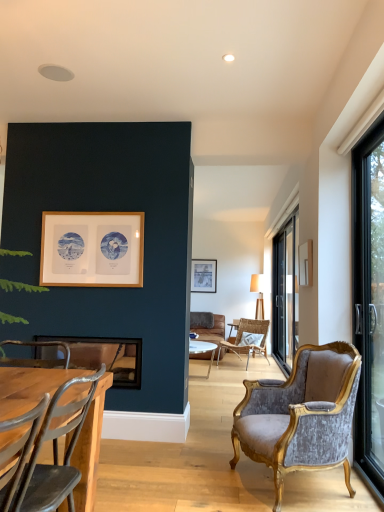
Question: From their relative heights in the image, would you say black glass door at right, placed as the first window when sorted from back to front, is taller or shorter than wooden frame at upper left, the third picture frame positioned from the bottom?

Choices:
 (A) tall
 (B) short

Answer: (A)

Question: Based on their positions, is black glass door at right, marked as the second window in a front-to-back arrangement, located to the left or right of wooden frame at upper left, which ranks as the second picture frame in front-to-back order?

Choices:
 (A) right
 (B) left

Answer: (A)

Question: Which of these objects is positioned farthest from the woven rattan chair at center, the first chair positioned from the back?

Choices:
 (A) matte wooden picture frame at center, the 3th picture frame positioned from the front
 (B) velvet/gold armchair at right, which is the 2th chair in back-to-front order
 (C) black glass door at right, which appears as the first window when viewed from the left
 (D) wooden frame at upper left, the 2th picture frame when ordered from back to front
 (E) black glass door at right, the 1th window in the right-to-left sequence

Answer: (C)

Question: Which object is the closest to the black glass door at right, marked as the second window in a front-to-back arrangement?

Choices:
 (A) metallic gray chair at lower left, the 1th chair viewed from the left
 (B) wooden frame at upper left, the 2th picture frame when ordered from back to front
 (C) matte wooden picture frame at center, positioned as the 2th picture frame in top-to-bottom order
 (D) black glass door at right, which is counted as the 2th window, starting from the right
 (E) metallic silver picture frame at lower left, marked as the third picture frame in a top-to-bottom arrangement

Answer: (D)